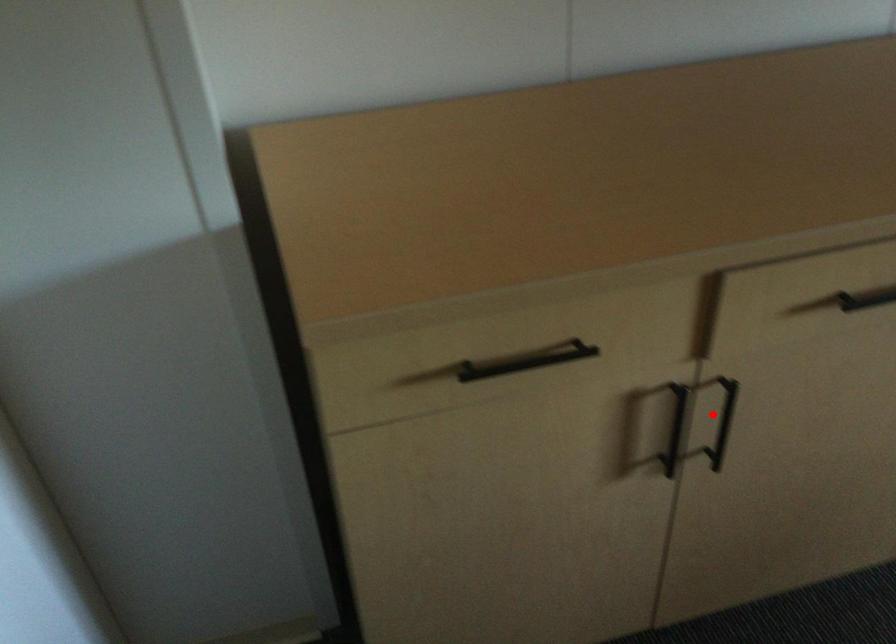
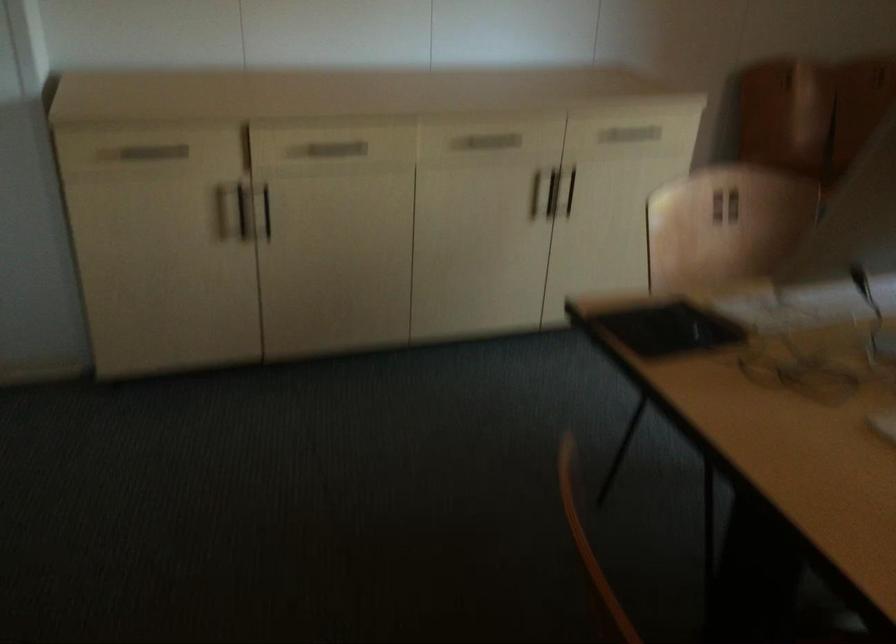
In the second image, find the point that corresponds to the highlighted location in the first image.

(264, 211)